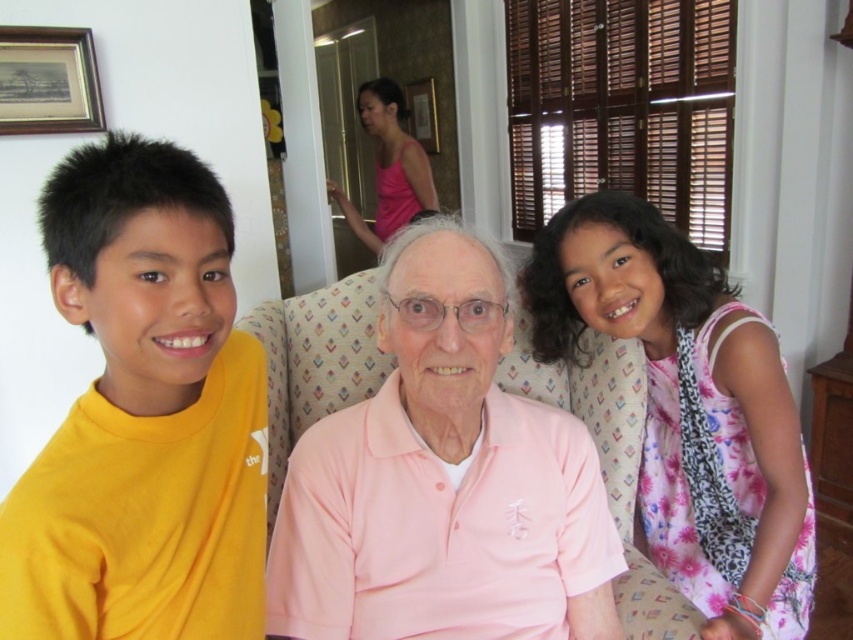
Question: Which object appears closest to the camera in this image?

Choices:
 (A) wooden framed print at upper left
 (B) pink floral dress at right
 (C) pink cotton polo shirt at center
 (D) yellow matte shirt at left

Answer: (D)

Question: Which object is the closest to the yellow matte shirt at left?

Choices:
 (A) wooden framed print at upper left
 (B) pink floral dress at right
 (C) pink cotton polo shirt at center

Answer: (C)

Question: Is the position of yellow matte shirt at left more distant than that of pink floral dress at right?

Choices:
 (A) no
 (B) yes

Answer: (A)

Question: Can you confirm if yellow matte shirt at left is positioned above wooden framed print at upper left?

Choices:
 (A) yes
 (B) no

Answer: (B)

Question: Is yellow matte shirt at left above pink floral dress at right?

Choices:
 (A) yes
 (B) no

Answer: (A)

Question: Which of the following is the closest to the observer?

Choices:
 (A) yellow matte shirt at left
 (B) pink cotton polo shirt at center

Answer: (A)